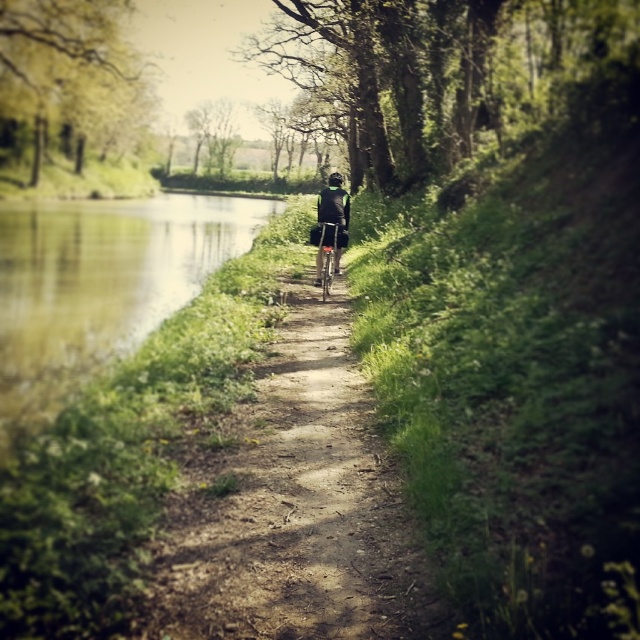
Question: Is dirt path at center smaller than black matte helmet at center?

Choices:
 (A) yes
 (B) no

Answer: (A)

Question: Which object is closer to the camera taking this photo?

Choices:
 (A) black matte jacket at center
 (B) metallic silver bicycle at center
 (C) green leafy tree at upper center
 (D) black matte helmet at center

Answer: (B)

Question: Considering the real-world distances, which object is closest to the dirt path at center?

Choices:
 (A) green leafy tree at upper left
 (B) black matte helmet at center
 (C) green leafy tree at center
 (D) metallic silver bicycle at center

Answer: (D)

Question: Does green leafy tree at upper center have a smaller size compared to black matte helmet at center?

Choices:
 (A) yes
 (B) no

Answer: (A)

Question: Does dirt path at center have a greater width compared to green leafy tree at center?

Choices:
 (A) no
 (B) yes

Answer: (A)

Question: Estimate the real-world distances between objects in this image. Which object is farther from the dirt path at center?

Choices:
 (A) black matte jacket at center
 (B) metallic silver bicycle at center
 (C) green leafy tree at upper center
 (D) green leafy tree at upper left

Answer: (C)